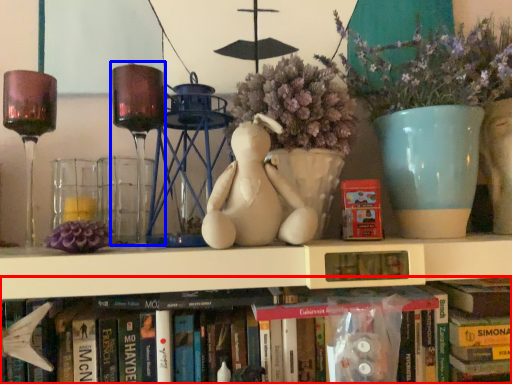
Question: Among these objects, which one is farthest to the camera, book (highlighted by a red box) or candle holder (highlighted by a blue box)?

Choices:
 (A) book
 (B) candle holder

Answer: (A)